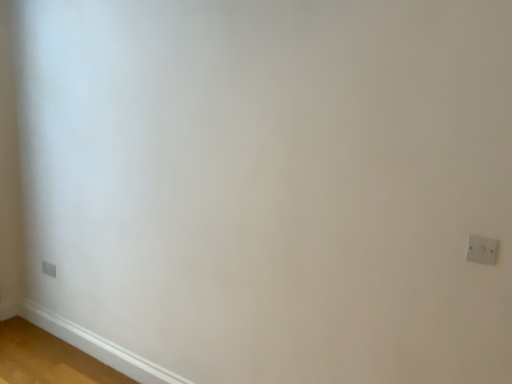
This screenshot has width=512, height=384. Describe the element at coordinates (49, 269) in the screenshot. I see `white plastic electric outlet at lower left` at that location.

Identify the location of white plastic electric outlet at lower left. (49, 269).

Find the location of a particular element. This screenshot has width=512, height=384. white plastic electric outlet at lower left is located at coordinates (49, 269).